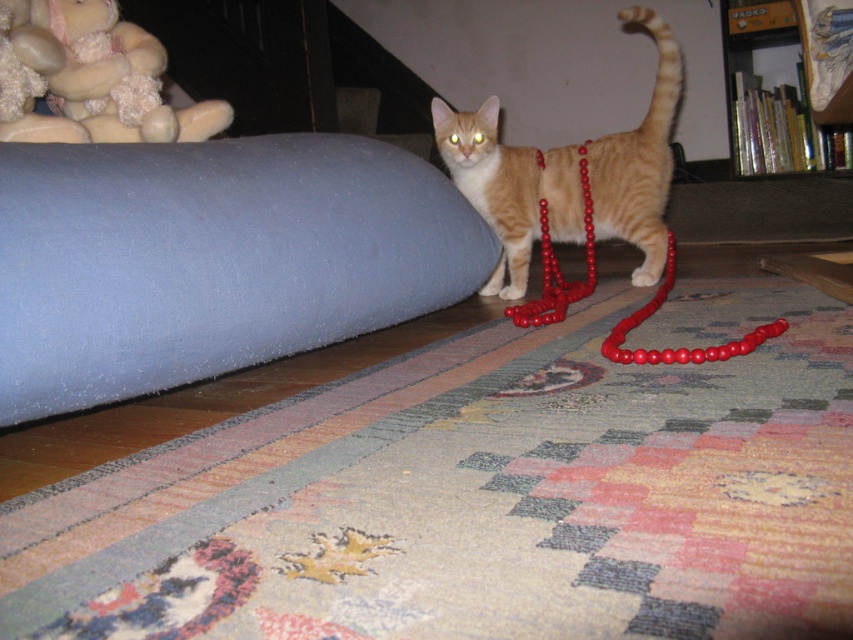
You are a photographer who wants to capture the orange fur cat at center and the red beads at center in a single frame. Based on their positions, which object should you adjust to ensure both are fully visible in the photo?

The orange fur cat at center is to the left of the red beads at center. To ensure both are fully visible, you should adjust the framing to include more space to the left where the cat is positioned and the right side where the beads are located.

You are a small toy that is 10 cm tall. You are placed on the carpeted floor at lower center. Can you see the red beads at center without moving?

The carpeted floor at lower center is shorter than red beads at center, so yes, the toy can see the red beads at center because they are taller than the carpeted floor at lower center.